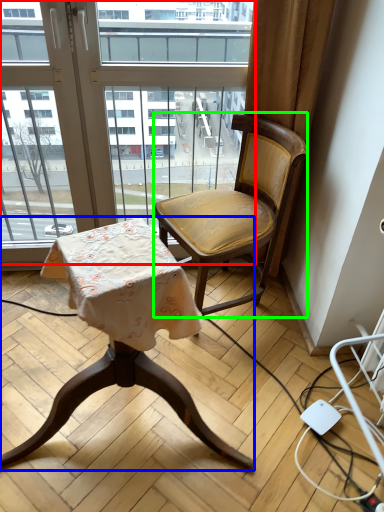
Question: Based on their relative distances, which object is nearer to window (highlighted by a red box)? Choose from chair (highlighted by a blue box) and chair (highlighted by a green box).

Choices:
 (A) chair
 (B) chair

Answer: (B)